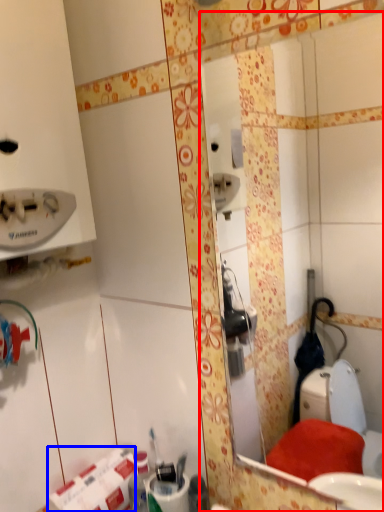
Question: Among these objects, which one is farthest to the camera, mirror (highlighted by a red box) or toilet paper (highlighted by a blue box)?

Choices:
 (A) mirror
 (B) toilet paper

Answer: (B)